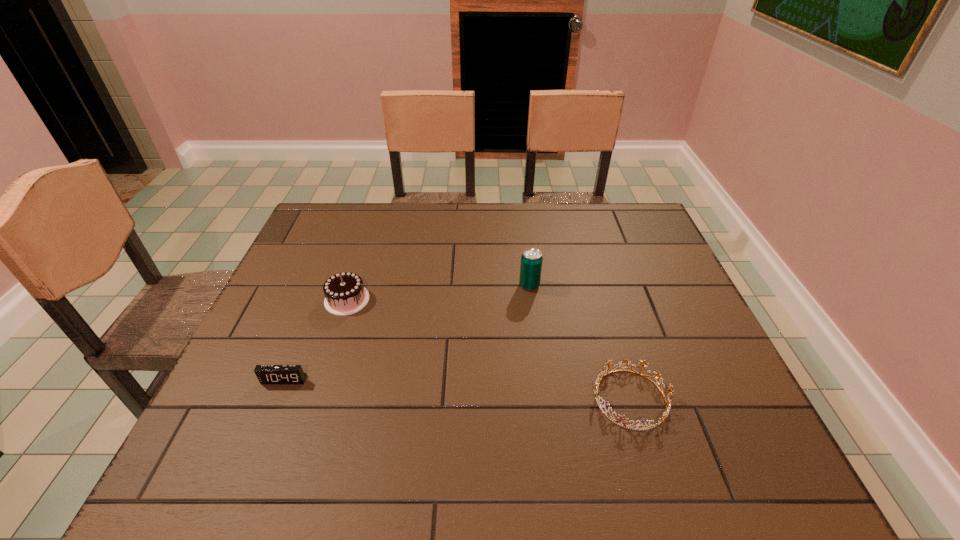
Locate an element on the screen. blank space located on the front-facing side of the alarm clock is located at coordinates coord(254,454).

Where is `chocolate cake that is at the left edge`? This screenshot has height=540, width=960. chocolate cake that is at the left edge is located at coordinates (345, 294).

I want to click on alarm clock at the left edge, so click(267, 374).

You are a GUI agent. You are given a task and a screenshot of the screen. Output one action in this format:
    pyautogui.click(x=<x>, y=<y>)
    Task: Click on the object positioned at the right edge
    The width and height of the screenshot is (960, 540).
    Given the screenshot: What is the action you would take?
    click(x=602, y=375)

Identify the location of free space at the far edge of the desktop. (543, 219).

Identify the location of vacant space at the near edge. The image size is (960, 540). (607, 463).

Find the location of a particular element. This screenshot has height=540, width=960. free space at the left edge of the desktop is located at coordinates (308, 314).

Where is `vacant space at the right edge of the desktop`? This screenshot has height=540, width=960. vacant space at the right edge of the desktop is located at coordinates (655, 265).

I want to click on vacant space at the far right corner, so click(x=641, y=224).

Where is `free space between the third object from left to right and the third shortest object`? The width and height of the screenshot is (960, 540). free space between the third object from left to right and the third shortest object is located at coordinates pyautogui.click(x=438, y=293).